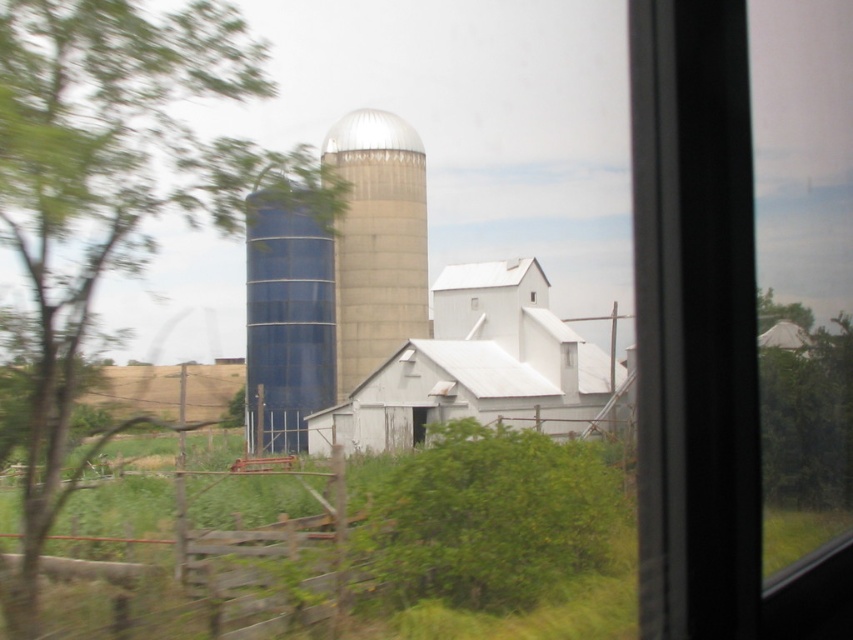
Can you confirm if blue metallic water tower at center-left is shorter than white matte window at center?

Incorrect, blue metallic water tower at center-left's height does not fall short of white matte window at center's.

Does point (258, 397) come behind point (531, 300)?

That is False.

I want to click on blue metallic water tower at center-left, so click(286, 321).

Can you confirm if white matte barn at center is smaller than green leafy tree at right?

Actually, white matte barn at center might be larger than green leafy tree at right.

Where is `white matte barn at center`? This screenshot has height=640, width=853. white matte barn at center is located at coordinates (476, 368).

Between point (498, 276) and point (535, 294), which one is positioned behind?

The point (535, 294) is behind.

Who is taller, white matte barn at center or white matte window at center?

white matte barn at center

Is point (466, 417) positioned after point (532, 296)?

No, (466, 417) is closer to viewer.

Locate an element on the screen. This screenshot has height=640, width=853. white matte barn at center is located at coordinates (476, 368).